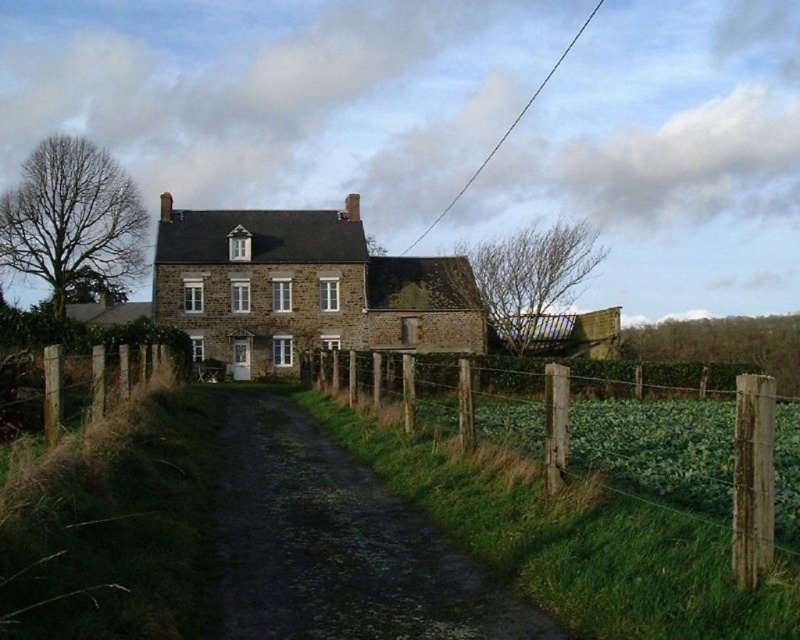
Is dirt/gravel path at center behind wooden post fence at right?

That is False.

Where is `dirt/gravel path at center`? This screenshot has height=640, width=800. dirt/gravel path at center is located at coordinates (336, 545).

Who is more forward, (298,611) or (780,497)?

Point (298,611) is more forward.

You are a GUI agent. You are given a task and a screenshot of the screen. Output one action in this format:
    pyautogui.click(x=<x>, y=<y>)
    Task: Click on the dirt/gravel path at center
    The width and height of the screenshot is (800, 640).
    Given the screenshot: What is the action you would take?
    [336, 545]